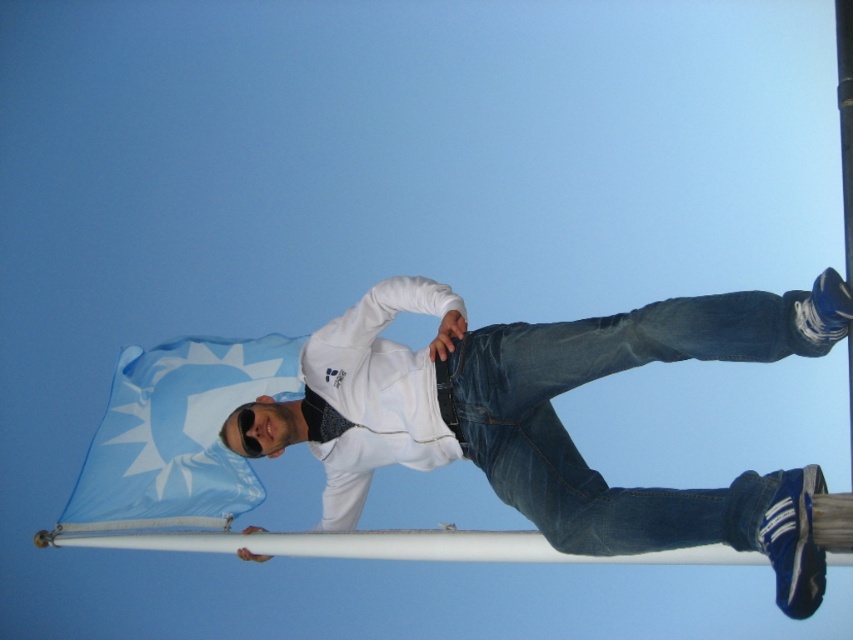
Question: Can you confirm if white matte hoodie at center is positioned to the right of denim at center?

Choices:
 (A) yes
 (B) no

Answer: (B)

Question: Which object is closer to the camera taking this photo?

Choices:
 (A) blue fabric flag at upper left
 (B) denim at center
 (C) white matte hoodie at center

Answer: (C)

Question: Which point is farther to the camera?

Choices:
 (A) (144, 371)
 (B) (466, 353)
 (C) (567, 448)

Answer: (A)

Question: From the image, what is the correct spatial relationship of denim at center in relation to blue fabric flag at upper left?

Choices:
 (A) left
 (B) right

Answer: (B)

Question: Considering the relative positions of white matte hoodie at center and denim at center in the image provided, where is white matte hoodie at center located with respect to denim at center?

Choices:
 (A) above
 (B) below

Answer: (A)

Question: Which object is farther from the camera taking this photo?

Choices:
 (A) white matte hoodie at center
 (B) denim at center

Answer: (B)